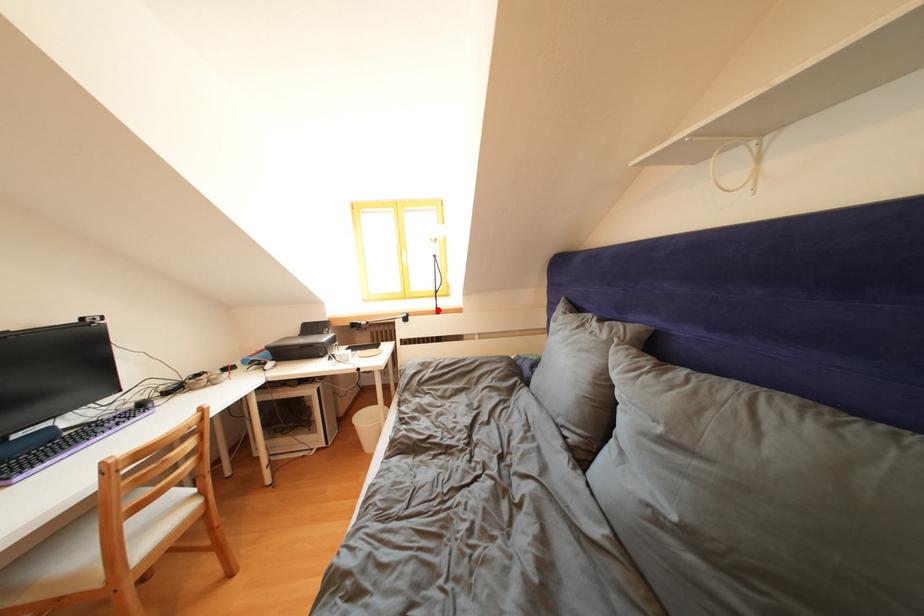
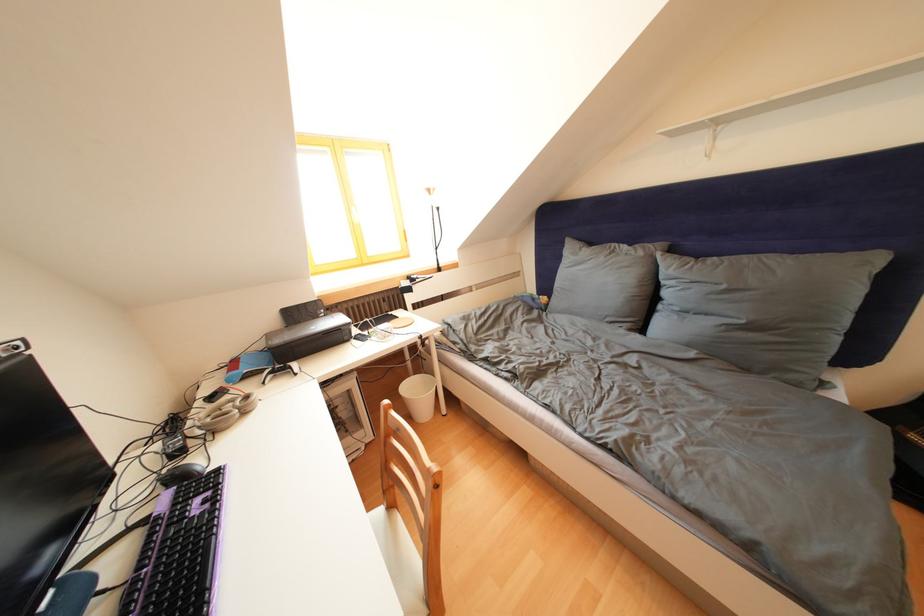
Where in the second image is the point corresponding to the highlighted location from the first image?

(440, 268)